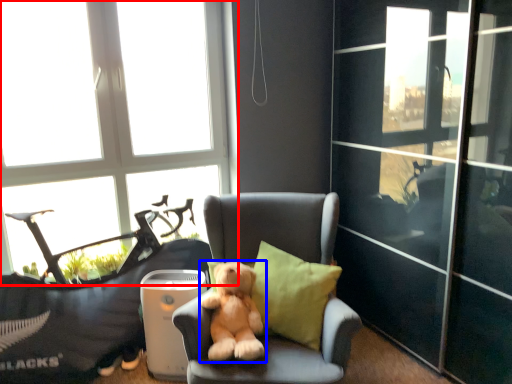
Question: Which object appears closest to the camera in this image, window (highlighted by a red box) or dog (highlighted by a blue box)?

Choices:
 (A) window
 (B) dog

Answer: (B)